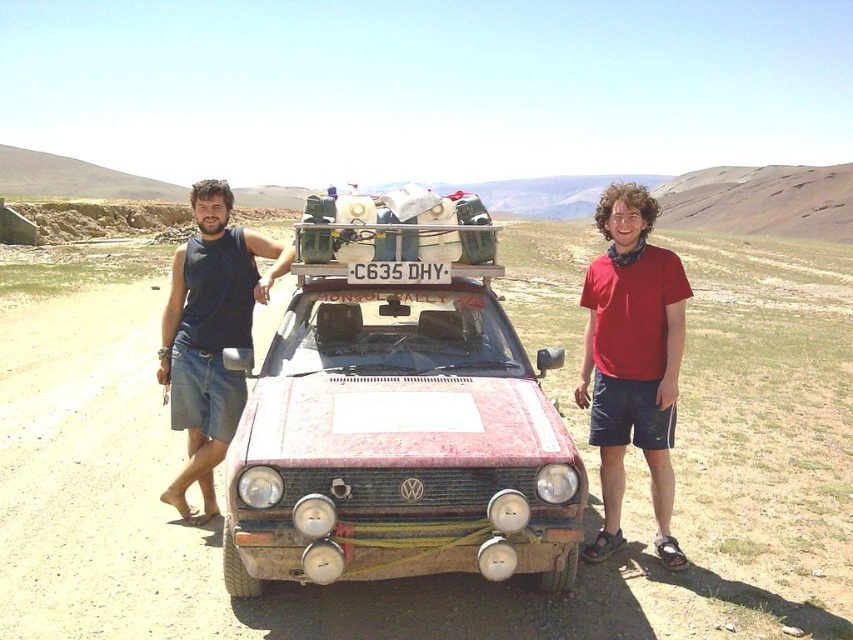
You are a GUI agent. You are given a task and a screenshot of the screen. Output one action in this format:
    pyautogui.click(x=<x>, y=<y>)
    Task: Click on the red cotton shirt at center
    This screenshot has height=640, width=853.
    Given the screenshot: What is the action you would take?
    pyautogui.click(x=631, y=360)

Does point (576, 394) come in front of point (241, 384)?

That is True.

What do you see at coordinates (631, 360) in the screenshot? This screenshot has width=853, height=640. I see `red cotton shirt at center` at bounding box center [631, 360].

I want to click on red cotton shirt at center, so click(631, 360).

Can you confirm if rusty metal car at center is shorter than red cotton shirt at center?

Yes, rusty metal car at center is shorter than red cotton shirt at center.

What do you see at coordinates (399, 445) in the screenshot? This screenshot has height=640, width=853. I see `rusty metal car at center` at bounding box center [399, 445].

Is point (366, 550) behind point (628, 208)?

No, (366, 550) is in front of (628, 208).

Find the location of `rusty metal car at center`. rusty metal car at center is located at coordinates (399, 445).

This screenshot has height=640, width=853. What are the coordinates of `rusty metal car at center` in the screenshot? It's located at (399, 445).

Between point (408, 410) and point (247, 321), which one is positioned in front?

Point (408, 410) is in front.

Which is behind, point (575, 481) or point (160, 371)?

Positioned behind is point (160, 371).

This screenshot has width=853, height=640. Identify the location of rusty metal car at center. (399, 445).